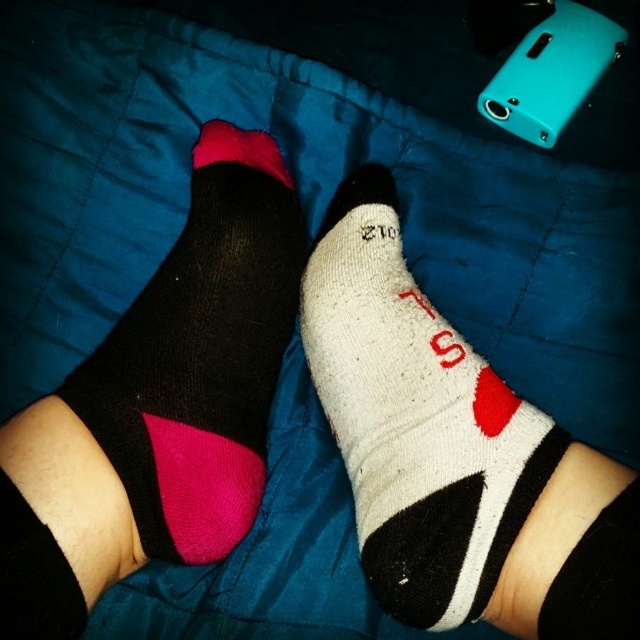
You are organizing a sock drawer and need to place the white cotton sock at center and the matte black sock at left into the drawer. Since the drawer has limited space, can you determine which sock is closer to you to ensure proper placement?

The white cotton sock at center is in front of the matte black sock at left, so you should place the white cotton sock at center first as it is closer to you.

You are a delivery robot trying to place a small package between the white cotton sock at center and the matte black sock at left. The package is 10 inches long. Can you fit it between them?

The distance between the white cotton sock at center and the matte black sock at left is 9.23 inches, so the 10 inch package cannot fit between them.